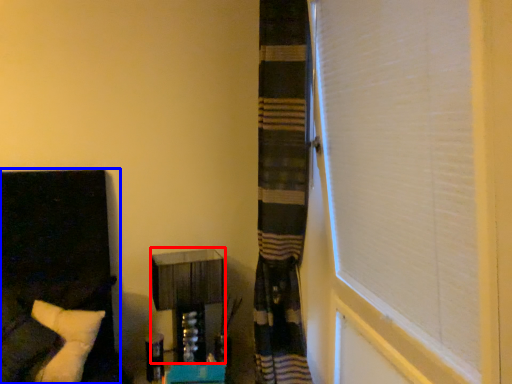
Question: Among these objects, which one is nearest to the camera, vanity (highlighted by a red box) or furniture (highlighted by a blue box)?

Choices:
 (A) vanity
 (B) furniture

Answer: (B)